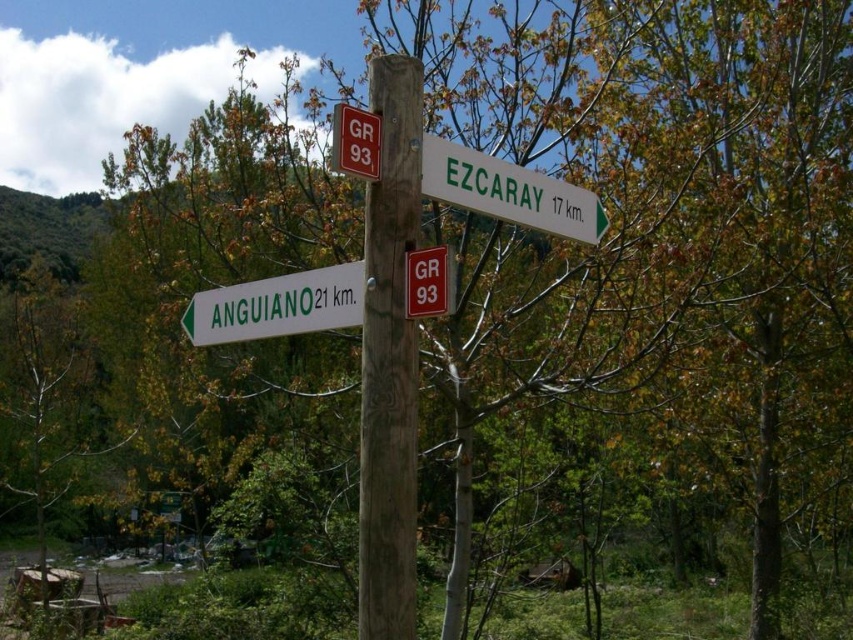
You are standing in front of the wooden post with signs. You need to find the direction to Anguiano. Which sign should you look at first, the white plastic sign at lower left or the red plastic sign at upper center?

The white plastic sign at lower left is to the left of the red plastic sign at upper center. Since the white plastic sign at lower left is positioned to the left, you should look at it first before checking the red plastic sign at upper center.

You are a hiker carrying a backpack and need to read the white plastic sign at lower left while standing next to the wooden post at center. Can you read the sign without moving closer than 18.85 inches from the post?

The wooden post at center and white plastic sign at lower left are 18.85 inches apart from each other, so if you are already standing next to the wooden post at center, you are already within the 18.85 inches distance required to reach the white plastic sign at lower left. Therefore, you can read the sign without needing to move closer.